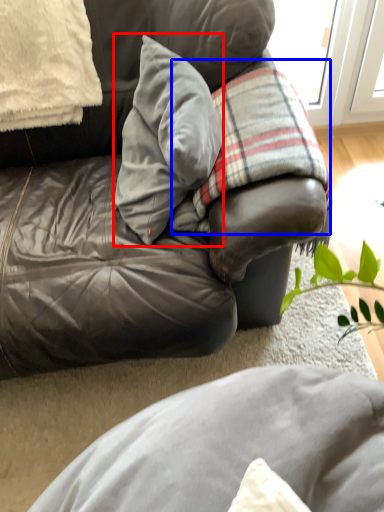
Question: Which object appears closest to the camera in this image, pillow (highlighted by a red box) or plaid (highlighted by a blue box)?

Choices:
 (A) pillow
 (B) plaid

Answer: (A)